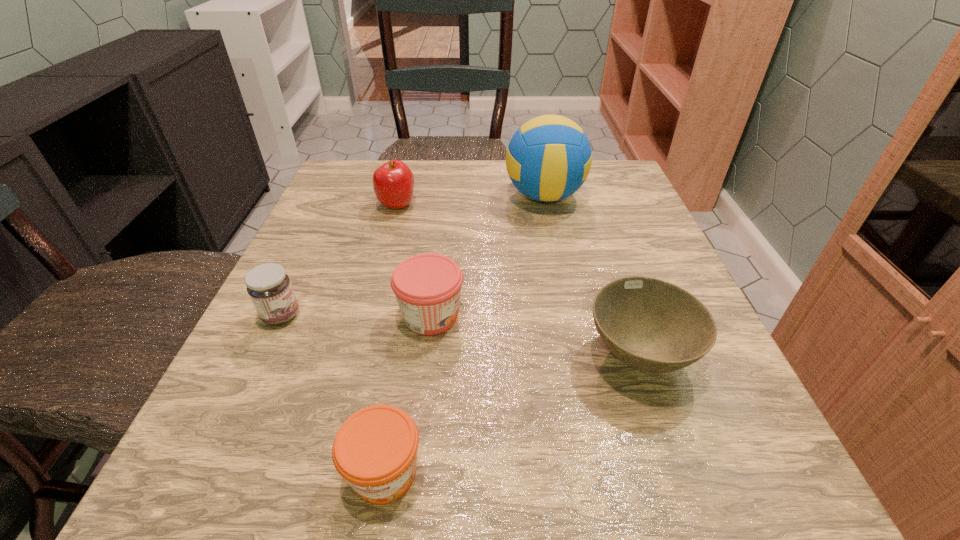
This screenshot has width=960, height=540. What are the coordinates of `volleyball` in the screenshot? It's located at (549, 157).

Identify the location of apple. The width and height of the screenshot is (960, 540). (393, 182).

Find the location of `the leftmost object`. the leftmost object is located at coordinates (269, 287).

The height and width of the screenshot is (540, 960). Find the location of `bowl`. bowl is located at coordinates (651, 325).

Find the location of a particular element. The height and width of the screenshot is (540, 960). the nearest jam is located at coordinates (375, 450).

Locate an element on the screen. The image size is (960, 540). vacant point located on the right of the volleyball is located at coordinates (615, 196).

This screenshot has height=540, width=960. What are the coordinates of `free space located on the right of the apple` in the screenshot? It's located at (444, 205).

You are a GUI agent. You are given a task and a screenshot of the screen. Output one action in this format:
    pyautogui.click(x=<x>, y=<y>)
    Task: Click on the free space located on the front label of the leftmost object
    
    Given the screenshot: What is the action you would take?
    pyautogui.click(x=479, y=315)

Locate an element on the screen. This screenshot has height=540, width=960. free region located 0.290m on the back of the bowl is located at coordinates (591, 217).

Where is `volleyball located at the far edge`? This screenshot has height=540, width=960. volleyball located at the far edge is located at coordinates (549, 157).